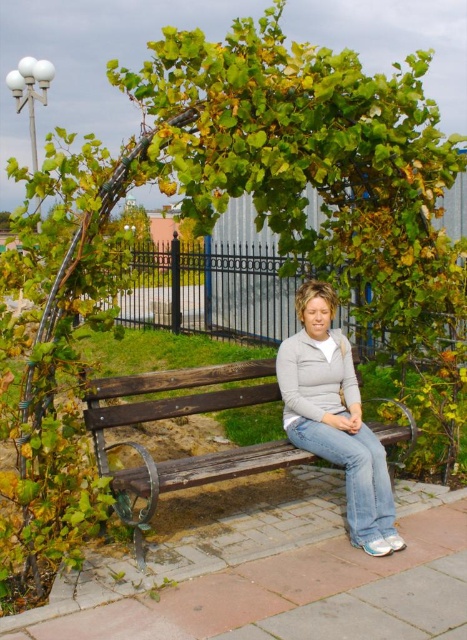
Does point (298, 449) come behind point (346, 428)?

Yes, it is behind point (346, 428).

Which of these two, wooden bench at center or light gray fleece sweater at center, stands taller?

light gray fleece sweater at center is taller.

What do you see at coordinates (176, 417) in the screenshot?
I see `wooden bench at center` at bounding box center [176, 417].

You are a GUI agent. You are given a task and a screenshot of the screen. Output one action in this format:
    pyautogui.click(x=<x>, y=<y>)
    Task: Click on the wooden bench at center
    
    Given the screenshot: What is the action you would take?
    pyautogui.click(x=176, y=417)